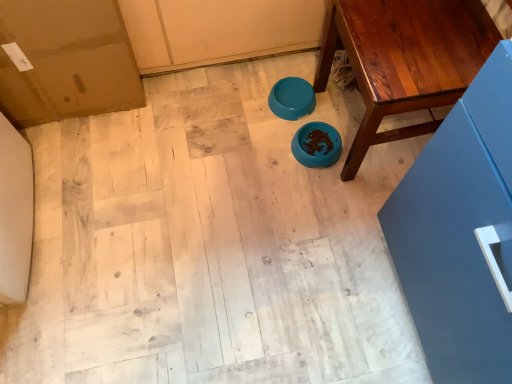
Where is `free space that is to the left of wooden table at center`? The width and height of the screenshot is (512, 384). free space that is to the left of wooden table at center is located at coordinates (258, 145).